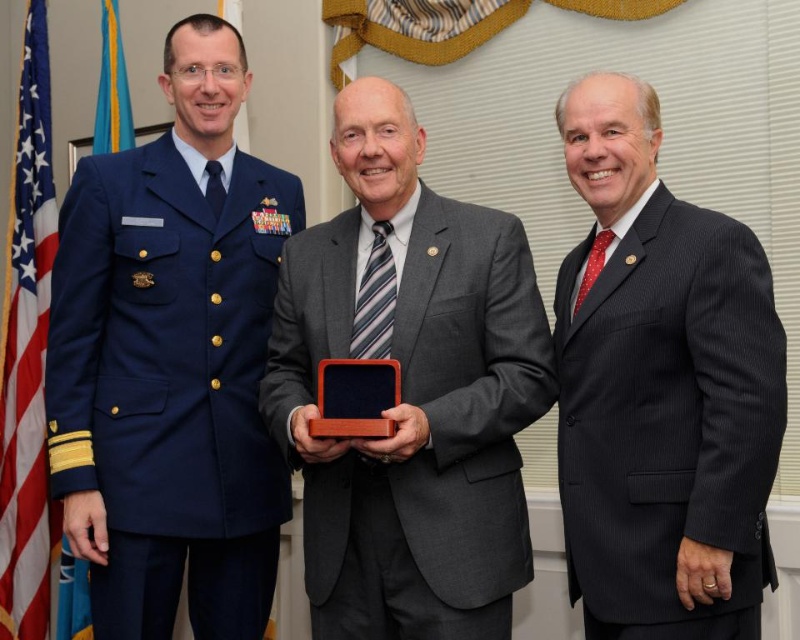
From the picture: You are taking a photo of two points in the scene. The first point is at coordinate point (536, 321) and the second is at point (4, 612). Which point will appear larger in your photo?

Point (536, 321) is closer to the camera than point (4, 612), so it will appear larger in the photo.